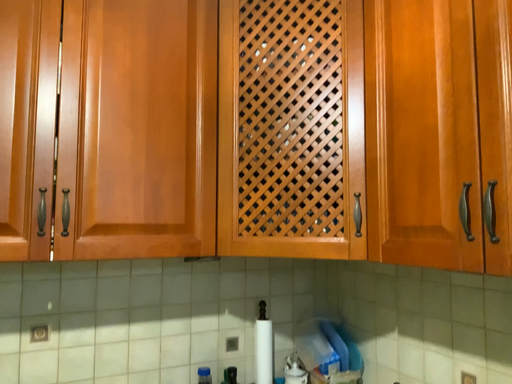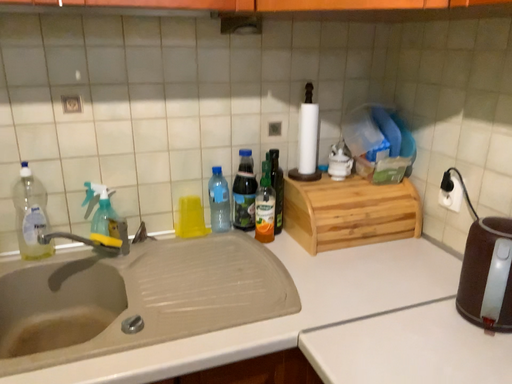
Question: Which way did the camera rotate in the video?

Choices:
 (A) rotated upward
 (B) rotated downward

Answer: (B)